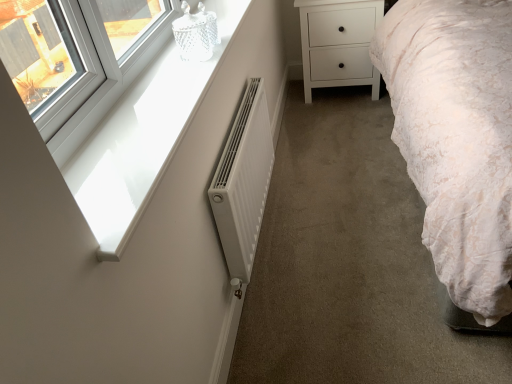
You are a GUI agent. You are given a task and a screenshot of the screen. Output one action in this format:
    pyautogui.click(x=<x>, y=<y>)
    Task: Click on the vacant region above white glossy window sill at upper left (from a real-world perspective)
    
    Given the screenshot: What is the action you would take?
    pyautogui.click(x=152, y=97)